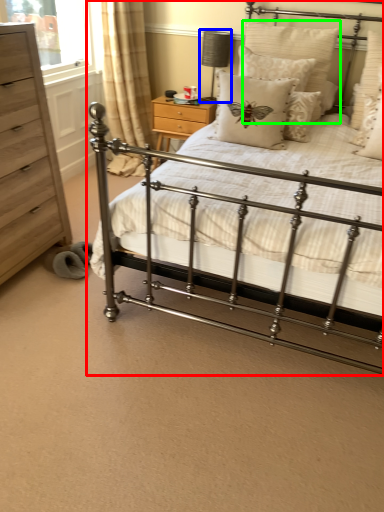
Question: Which object is positioned farthest from bed (highlighted by a red box)? Select from table lamp (highlighted by a blue box) and pillow (highlighted by a green box).

Choices:
 (A) table lamp
 (B) pillow

Answer: (A)